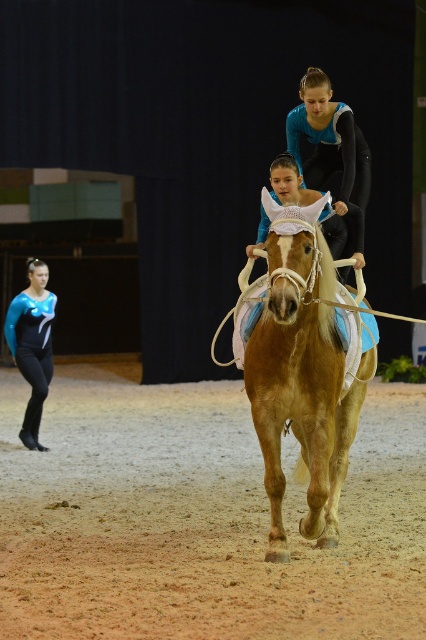
You are a photographer standing at the edge of the arena. You want to capture a wide shot of the brown sandy dirt track at lower center and the light brown leather horse at center. Given the track is larger, will the horse fit entirely within the frame if you focus on the track?

The brown sandy dirt track at lower center has a larger size compared to the light brown leather horse at center, so yes, the horse will fit entirely within the frame if you focus on the track.

You are a photographer positioned at the back of the arena. You need to capture a clear shot of both the light brown leather horse at center and the matte blue leotard at lower left. Which object should you focus on first to ensure it appears larger in your photo?

The light brown leather horse at center should be focused on first because it is closer to the viewer than the matte blue leotard at lower left, making it appear larger in the photo.

You are a spectator standing at the edge of the arena. You want to walk from your current position to the brown sandy dirt track at lower center without stepping on the light brown leather horse at center. Is there enough space between them for you to walk safely?

The distance between the brown sandy dirt track at lower center and the light brown leather horse at center is 5.24 feet. Since the minimum safe distance for walking around a horse is typically around 3 feet, there is sufficient space to walk safely between them without stepping on the horse.